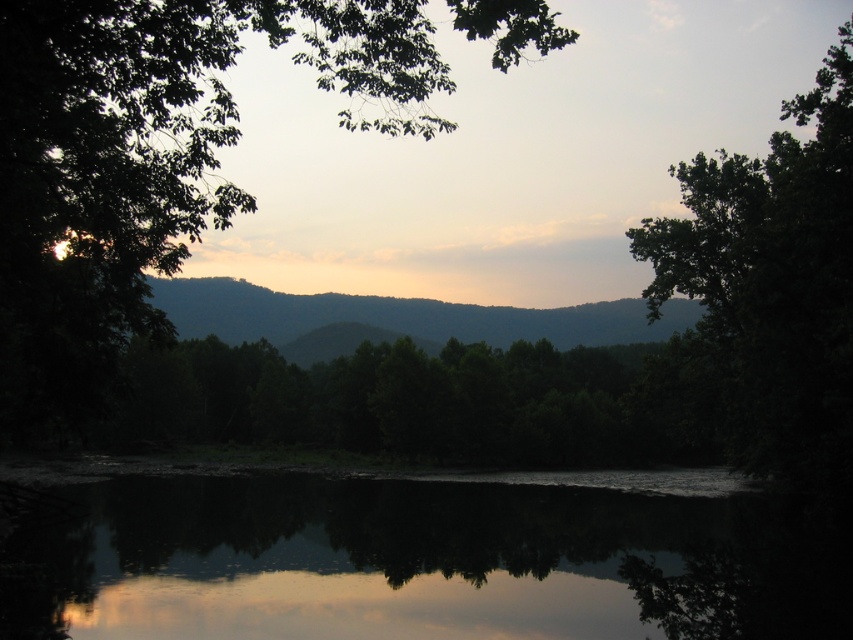
Question: Which object appears farthest from the camera in this image?

Choices:
 (A) green matte mountain at center
 (B) green leafy tree at upper right
 (C) reflective dark water at center

Answer: (A)

Question: Can you confirm if reflective dark water at center is bigger than green leafy tree at upper right?

Choices:
 (A) yes
 (B) no

Answer: (B)

Question: Is green leafy tree at upper right positioned in front of green matte mountain at center?

Choices:
 (A) no
 (B) yes

Answer: (B)

Question: Is reflective dark water at center below green matte mountain at center?

Choices:
 (A) no
 (B) yes

Answer: (B)

Question: Which point is farther to the camera?

Choices:
 (A) reflective dark water at center
 (B) green matte mountain at center

Answer: (B)

Question: Which object is positioned farthest from the reflective dark water at center?

Choices:
 (A) green leafy tree at center
 (B) green matte mountain at center

Answer: (B)